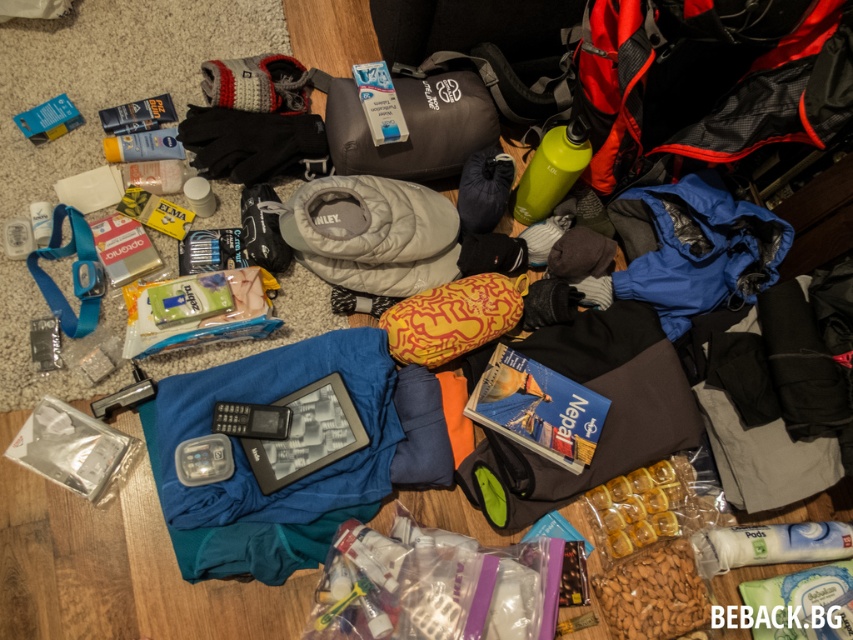
Who is lower down, blue fabric at center or gray quilted sleeping bag at center?

Positioned lower is blue fabric at center.

Does blue fabric at center appear on the right side of gray quilted sleeping bag at center?

In fact, blue fabric at center is to the left of gray quilted sleeping bag at center.

In the scene shown: Who is more forward, (x=355, y=499) or (x=299, y=205)?

Point (x=355, y=499)

This screenshot has width=853, height=640. Identify the location of blue fabric at center. (248, 465).